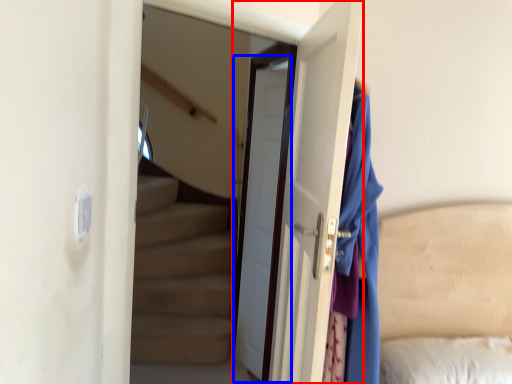
Question: Among these objects, which one is nearest to the camera, door (highlighted by a red box) or door (highlighted by a blue box)?

Choices:
 (A) door
 (B) door

Answer: (A)